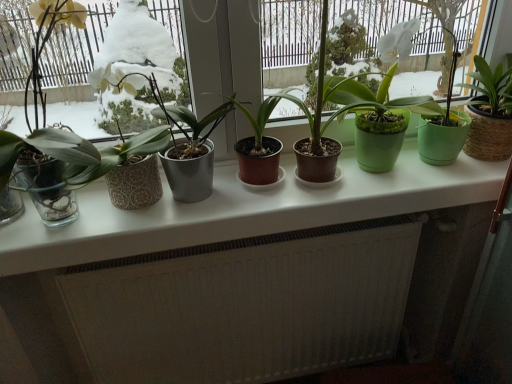
Locate an element on the screen. vacant area on top of white glossy counter top at center (from a real-world perspective) is located at coordinates (275, 189).